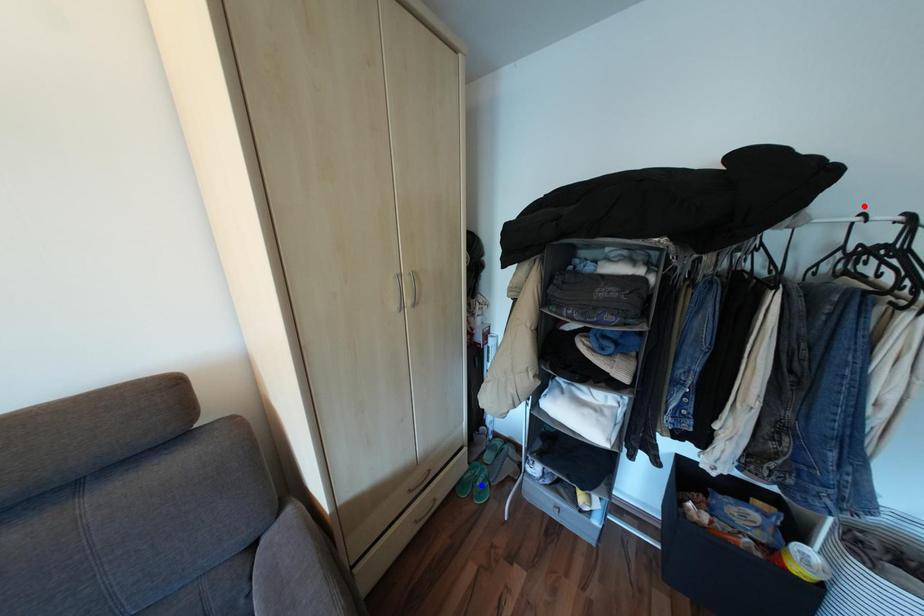
Question: In the image, two points are highlighted. Which point is nearer to the camera? Reply with the corresponding letter.

Choices:
 (A) blue point
 (B) red point

Answer: (B)